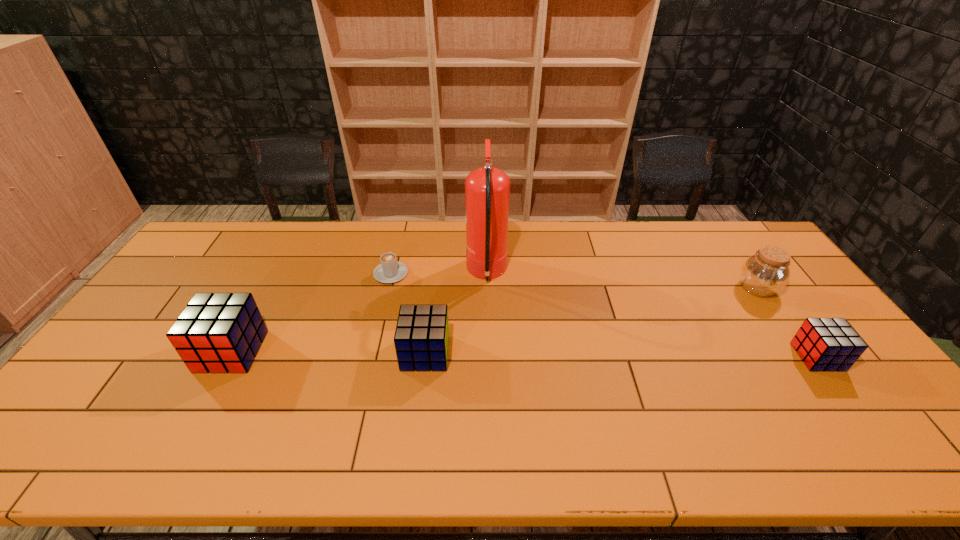
The height and width of the screenshot is (540, 960). I want to click on jar, so click(767, 272).

The image size is (960, 540). In order to click on free location located on the left of the tallest cube in this screenshot , I will do `click(112, 351)`.

Identify the location of free space located on the right of the third object from left to right. Image resolution: width=960 pixels, height=540 pixels. (530, 353).

Locate an element on the screen. vacant space located 0.200m on the left of the shortest cube is located at coordinates (725, 357).

I want to click on vacant space located to the right of the shortest object, so [403, 221].

I want to click on free location located 0.080m to the right of the shortest object, so click(396, 249).

This screenshot has height=540, width=960. Find the location of `free spot located to the right of the shortest object`. free spot located to the right of the shortest object is located at coordinates coord(402,225).

Find the location of a particular element. free space located 0.050m towards the nozzle of the fourth object from left to right is located at coordinates (451, 274).

Identify the location of free space located 0.250m towards the nozzle of the fourth object from left to right. (390, 274).

Identify the location of vacant space located towards the nozzle of the fourth object from left to right. Image resolution: width=960 pixels, height=540 pixels. (439, 274).